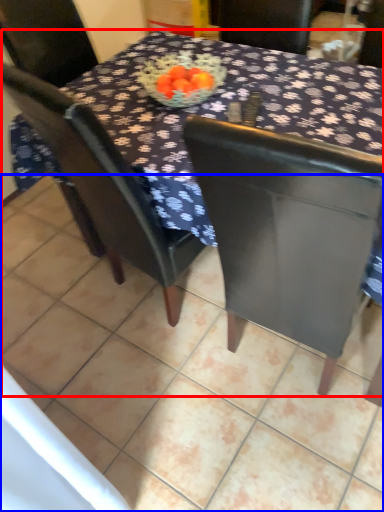
Question: Which point is closer to the camera, table (highlighted by a red box) or tile (highlighted by a blue box)?

Choices:
 (A) table
 (B) tile

Answer: (A)